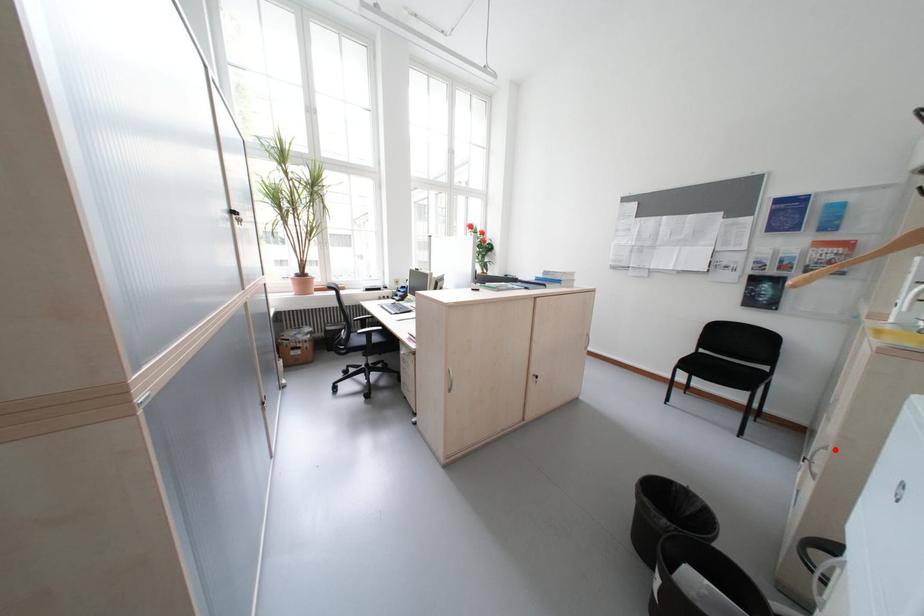
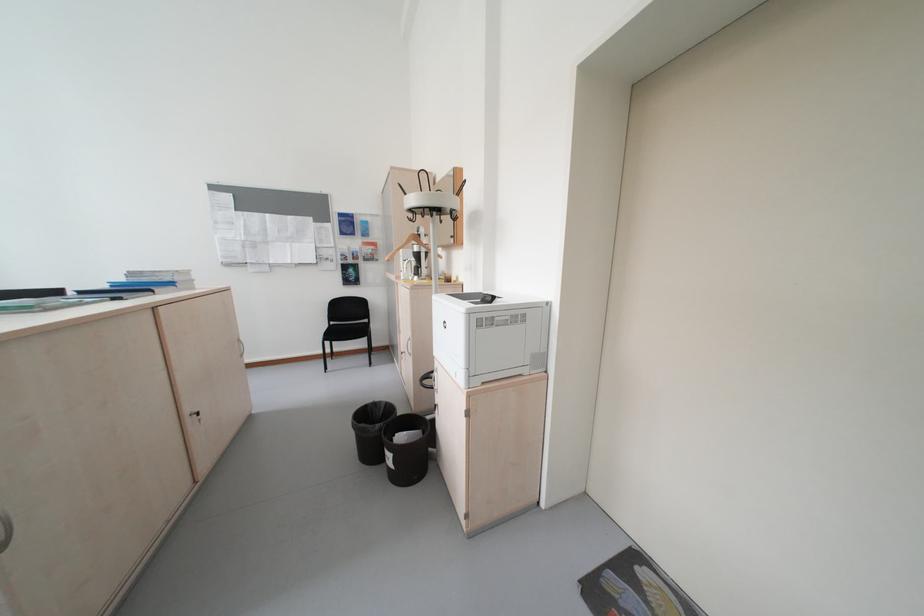
The point at the highlighted location is marked in the first image. Where is the corresponding point in the second image?

(419, 341)